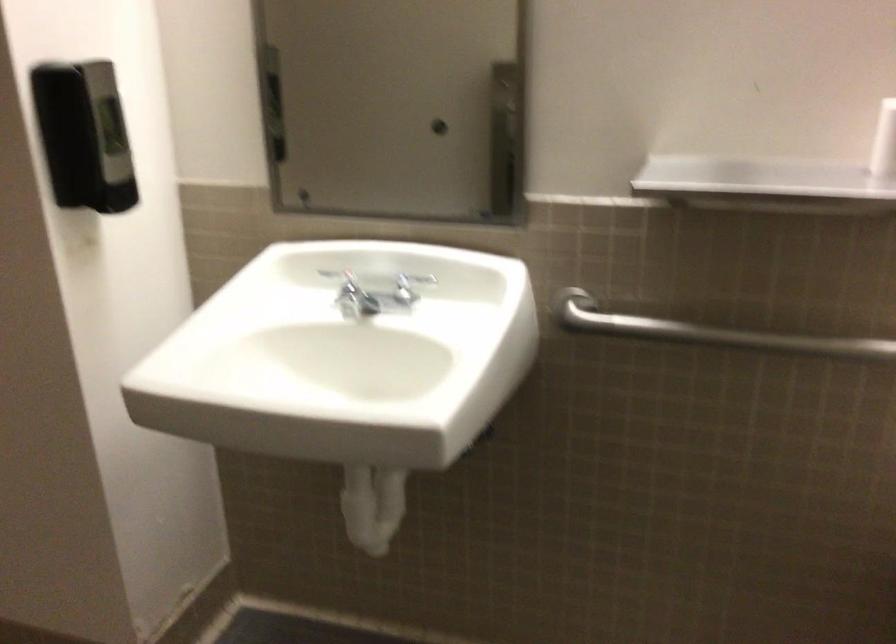
Where would you push the black soap dispenser? Please return your answer as a coordinate pair (x, y).

(83, 136)